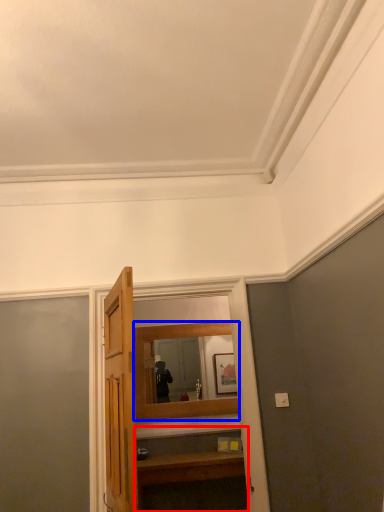
Question: Among these objects, which one is farthest to the camera, vanity (highlighted by a red box) or mirror (highlighted by a blue box)?

Choices:
 (A) vanity
 (B) mirror

Answer: (B)